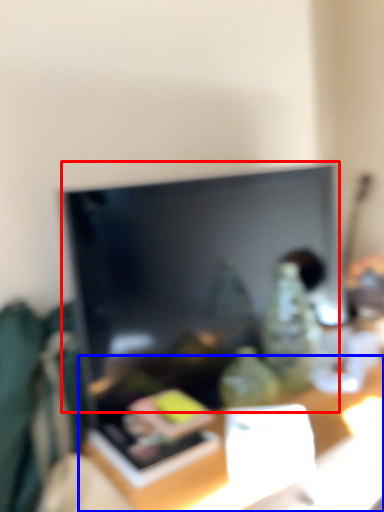
Question: Which object appears farthest to the camera in this image, television (highlighted by a red box) or table (highlighted by a blue box)?

Choices:
 (A) television
 (B) table

Answer: (A)